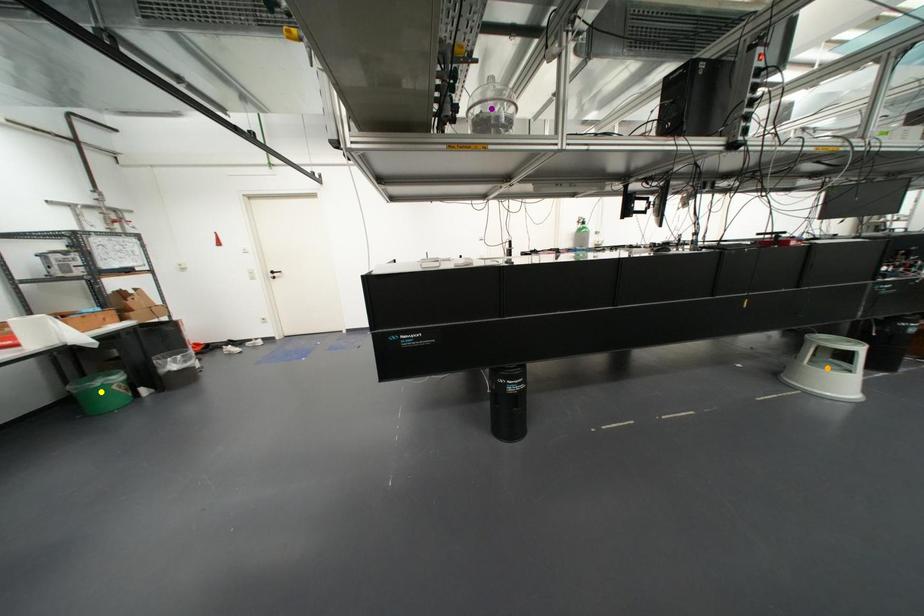
Order these from farthest to nearest:
purple point, orange point, yellow point

yellow point, orange point, purple point